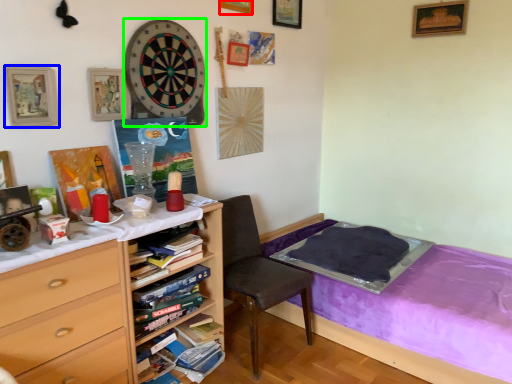
Question: Which object is positioned closest to picture frame (highlighted by a red box)? Select from picture frame (highlighted by a blue box) and clock (highlighted by a green box).

Choices:
 (A) picture frame
 (B) clock

Answer: (B)